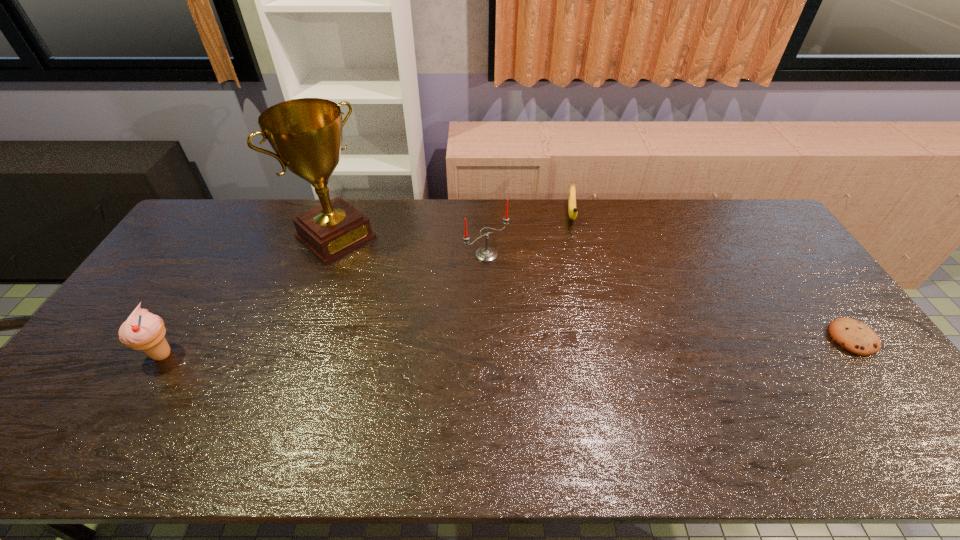
This screenshot has height=540, width=960. In order to click on vacant space on the desktop that is between the leftmost object and the cookie and is positioned on the front-facing side of the third object from left to right in this screenshot , I will do `click(591, 345)`.

Locate an element on the screen. vacant space on the desktop that is between the leftmost object and the cookie and is positioned at the stem of the fourth object from left to right is located at coordinates (580, 345).

This screenshot has height=540, width=960. Identify the location of vacant space on the desktop that is between the icecream and the shortest object and is positioned on the plaque of the second object from left to right. (463, 347).